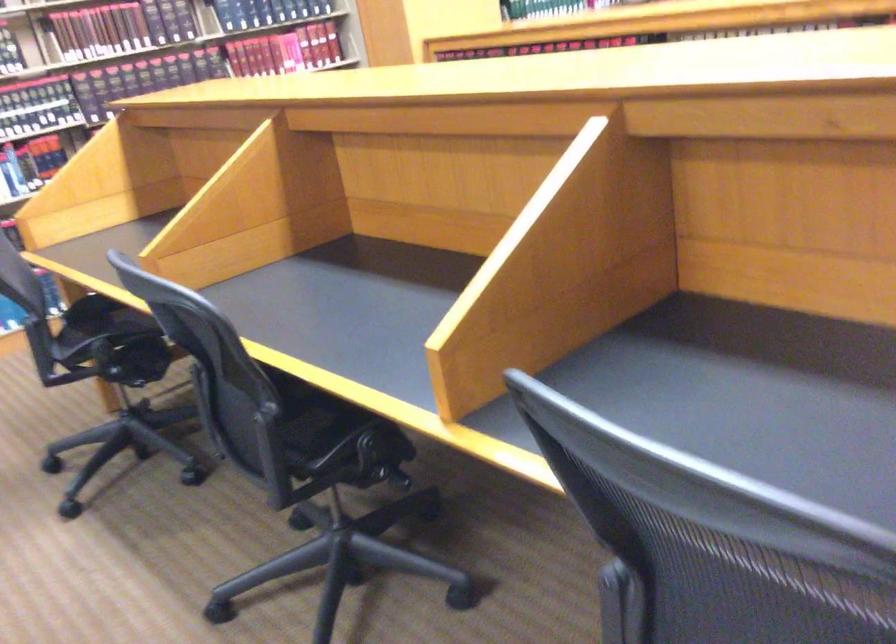
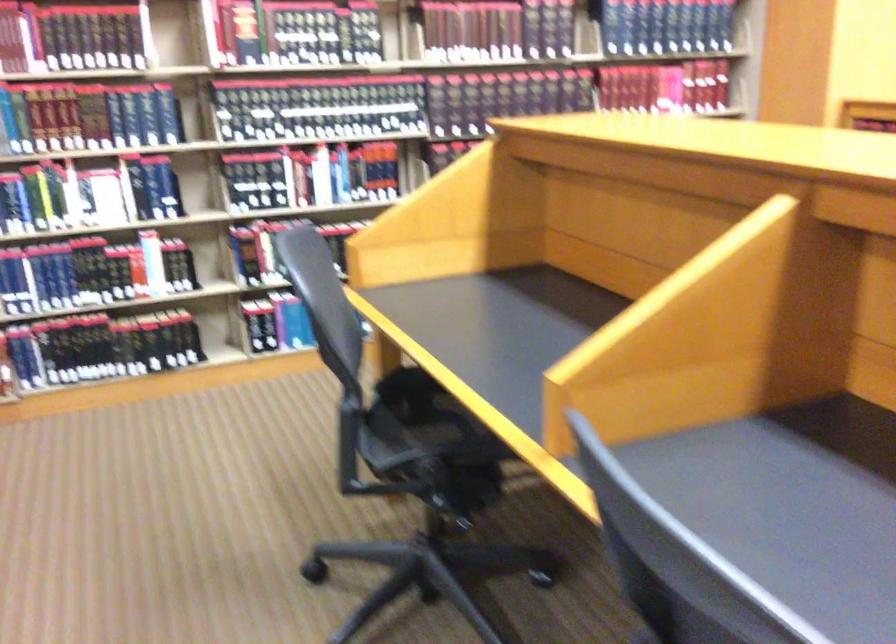
The images are taken continuously from a first-person perspective. In which direction are you moving?

The movement direction of the cameraman is left, forward.